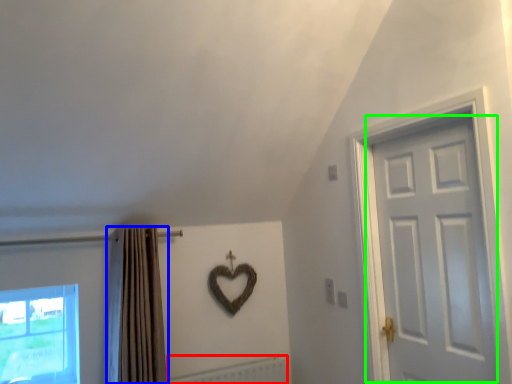
Question: Based on their relative distances, which object is nearer to radiator (highlighted by a red box)? Choose from curtain (highlighted by a blue box) and door (highlighted by a green box).

Choices:
 (A) curtain
 (B) door

Answer: (A)